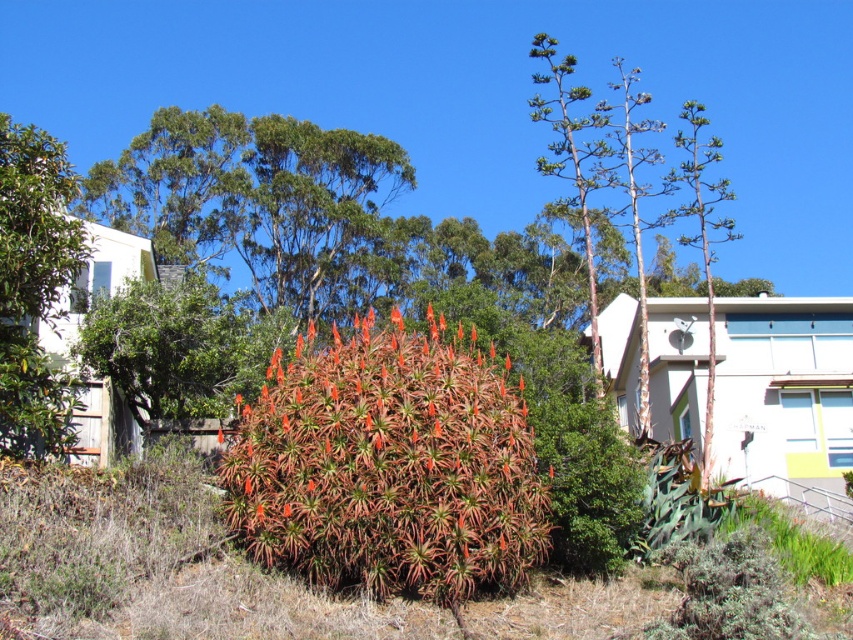
Does green succulent at center appear on the left side of green glossy leafy tree at left?

Incorrect, green succulent at center is not on the left side of green glossy leafy tree at left.

Does green succulent at center appear under green glossy leafy tree at left?

Yes, green succulent at center is below green glossy leafy tree at left.

Is point (393, 525) in front of point (22, 424)?

Yes.

Where is `green succulent at center`? This screenshot has width=853, height=640. green succulent at center is located at coordinates (389, 465).